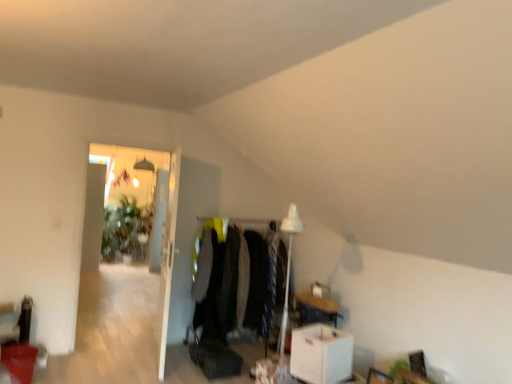
Find the location of a particular element. This screenshot has width=512, height=384. velvet black coat at center is located at coordinates (263, 278).

This screenshot has width=512, height=384. What do you see at coordinates (167, 259) in the screenshot?
I see `white glossy door at upper left` at bounding box center [167, 259].

Locate an element on the screen. velvet black coat at center is located at coordinates (263, 278).

Which object is positioned more to the right, white cardboard box at lower right or transparent glass door at left?

Positioned to the right is white cardboard box at lower right.

Is white cardboard box at lower right further to camera compared to transparent glass door at left?

No, the depth of white cardboard box at lower right is less than that of transparent glass door at left.

Can you see white cardboard box at lower right touching transparent glass door at left?

No, white cardboard box at lower right is not next to transparent glass door at left.

From the image's perspective, is white cardboard box at lower right below transparent glass door at left?

Yes.

Can white cardboard box at lower right be found inside transparent glass door at left?

No, white cardboard box at lower right is not a part of transparent glass door at left.

Can you confirm if transparent glass door at left is shorter than white cardboard box at lower right?

No, transparent glass door at left is not shorter than white cardboard box at lower right.

Is point (147, 205) closer to camera compared to point (313, 351)?

No, it is behind (313, 351).

From the picture: Can transparent glass door at left be found inside velvet black coat at center?

No.

Identify the location of glass door positioned vertically above the velvet black coat at center (from a real-world perspective). The height and width of the screenshot is (384, 512). (143, 209).

From a real-world perspective, is velvet black coat at center positioned under transparent glass door at left based on gravity?

Correct, in the physical world, velvet black coat at center is lower than transparent glass door at left.

Is transparent glass door at left to the left of velvet black coat at center from the viewer's perspective?

Yes.

Consider the image. Does transparent glass door at left turn towards velvet black coat at center?

No, transparent glass door at left does not turn towards velvet black coat at center.

Can you see transparent glass door at left touching velvet black coat at center?

transparent glass door at left and velvet black coat at center are clearly separated.

Is velvet black coat at center not within white glossy door at upper left?

Indeed, velvet black coat at center is completely outside white glossy door at upper left.

Looking at this image, does velvet black coat at center appear on the left side of white glossy door at upper left?

In fact, velvet black coat at center is to the right of white glossy door at upper left.

Find the location of a particular element. The width and height of the screenshot is (512, 384). door above the velvet black coat at center (from a real-world perspective) is located at coordinates (167, 259).

Considering the relative positions of transparent glass door at left and white glossy door at upper left in the image provided, is transparent glass door at left to the right of white glossy door at upper left from the viewer's perspective?

In fact, transparent glass door at left is to the left of white glossy door at upper left.

From a real-world perspective, is transparent glass door at left positioned under white glossy door at upper left based on gravity?

No, from a real-world perspective, transparent glass door at left is not beneath white glossy door at upper left.

Considering the sizes of objects transparent glass door at left and white glossy door at upper left in the image provided, who is thinner, transparent glass door at left or white glossy door at upper left?

white glossy door at upper left is thinner.

Which is behind, point (133, 233) or point (172, 199)?

The point (133, 233) is more distant.

Considering the sizes of objects white glossy door at upper left and transparent glass door at left in the image provided, who is wider, white glossy door at upper left or transparent glass door at left?

Wider between the two is transparent glass door at left.

Is white glossy door at upper left to the right of transparent glass door at left from the viewer's perspective?

Yes, white glossy door at upper left is to the right of transparent glass door at left.

Would you say white glossy door at upper left is a long distance from transparent glass door at left?

Indeed, white glossy door at upper left is not near transparent glass door at left.

Could you tell me if white glossy door at upper left is facing transparent glass door at left?

Yes, white glossy door at upper left is oriented towards transparent glass door at left.

I want to click on table that is below the transparent glass door at left (from the image's perspective), so click(x=321, y=354).

Locate an element on the screen. glass door lying behind the white cardboard box at lower right is located at coordinates (143, 209).

Considering their positions, is velvet black coat at center positioned closer to white glossy door at upper left than white cardboard box at lower right?

velvet black coat at center lies closer to white glossy door at upper left than the other object.

Consider the image. Considering their positions, is white glossy door at upper left positioned further to white cardboard box at lower right than transparent glass door at left?

transparent glass door at left is positioned further to the anchor white cardboard box at lower right.

When comparing their distances from white cardboard box at lower right, does velvet black coat at center or white glossy door at upper left seem closer?

velvet black coat at center.

When comparing their distances from velvet black coat at center, does transparent glass door at left or white cardboard box at lower right seem closer?

white cardboard box at lower right.

When comparing their distances from velvet black coat at center, does white glossy door at upper left or transparent glass door at left seem further?

transparent glass door at left is further to velvet black coat at center.

From the image, which object appears to be farther from white cardboard box at lower right, transparent glass door at left or velvet black coat at center?

transparent glass door at left lies further to white cardboard box at lower right than the other object.

Considering their positions, is velvet black coat at center positioned further to transparent glass door at left than white cardboard box at lower right?

white cardboard box at lower right lies further to transparent glass door at left than the other object.

Consider the image. Looking at the image, which one is located further to velvet black coat at center, transparent glass door at left or white glossy door at upper left?

transparent glass door at left is positioned further to the anchor velvet black coat at center.

Identify the location of door situated between transparent glass door at left and velvet black coat at center from left to right. The width and height of the screenshot is (512, 384). (167, 259).

Find the location of a particular element. This screenshot has height=384, width=512. door between transparent glass door at left and white cardboard box at lower right from left to right is located at coordinates (167, 259).

At what (x,y) coordinates should I click in order to perform the action: click on clothing between white glossy door at upper left and white cardboard box at lower right in the horizontal direction. Please return your answer as a coordinate pair (x, y). Looking at the image, I should click on (263, 278).

Where is `clothing situated between transparent glass door at left and white cardboard box at lower right from left to right`? This screenshot has width=512, height=384. clothing situated between transparent glass door at left and white cardboard box at lower right from left to right is located at coordinates pyautogui.click(x=263, y=278).